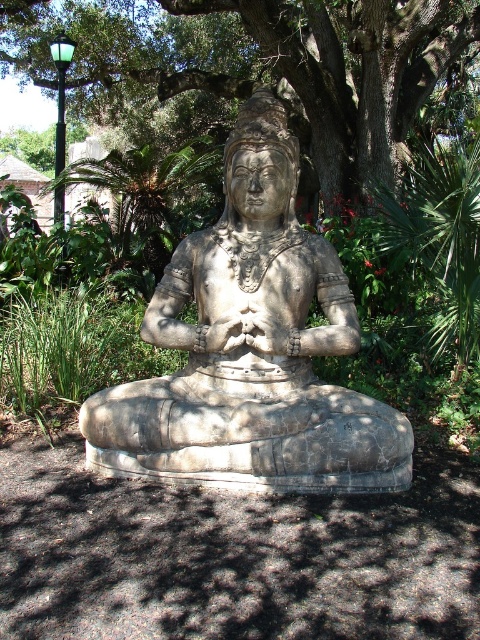
Question: Does gray stone statue at center have a larger size compared to green leafy tree at center?

Choices:
 (A) no
 (B) yes

Answer: (A)

Question: Is gray stone statue at center below green leafy tree at center?

Choices:
 (A) no
 (B) yes

Answer: (B)

Question: Among these objects, which one is nearest to the camera?

Choices:
 (A) green leafy tree at center
 (B) gray stone statue at center

Answer: (B)

Question: Does gray stone statue at center have a larger size compared to green leafy tree at center?

Choices:
 (A) no
 (B) yes

Answer: (A)

Question: Which object is farther from the camera taking this photo?

Choices:
 (A) gray stone statue at center
 (B) green leafy tree at center

Answer: (B)